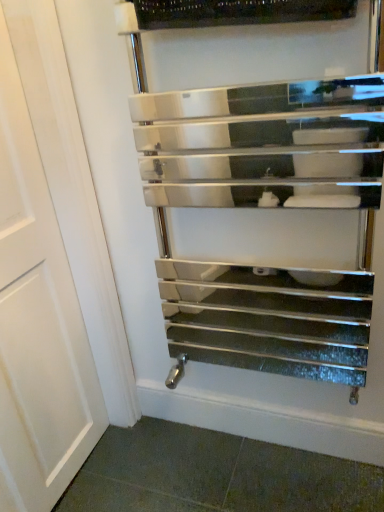
Question: Is white matte door at center in front of or behind polished chrome towel rack at center in the image?

Choices:
 (A) front
 (B) behind

Answer: (A)

Question: In terms of size, does white matte door at center appear bigger or smaller than polished chrome towel rack at center?

Choices:
 (A) small
 (B) big

Answer: (A)

Question: From a real-world perspective, relative to polished chrome towel rack at center, is white matte door at center vertically above or below?

Choices:
 (A) below
 (B) above

Answer: (A)

Question: Is polished chrome towel rack at center spatially inside white matte door at center, or outside of it?

Choices:
 (A) outside
 (B) inside

Answer: (A)

Question: From a real-world perspective, is polished chrome towel rack at center positioned above or below white matte door at center?

Choices:
 (A) below
 (B) above

Answer: (B)

Question: Is point (208, 294) positioned closer to the camera than point (16, 455)?

Choices:
 (A) closer
 (B) farther

Answer: (B)

Question: Is polished chrome towel rack at center taller or shorter than white matte door at center?

Choices:
 (A) short
 (B) tall

Answer: (A)